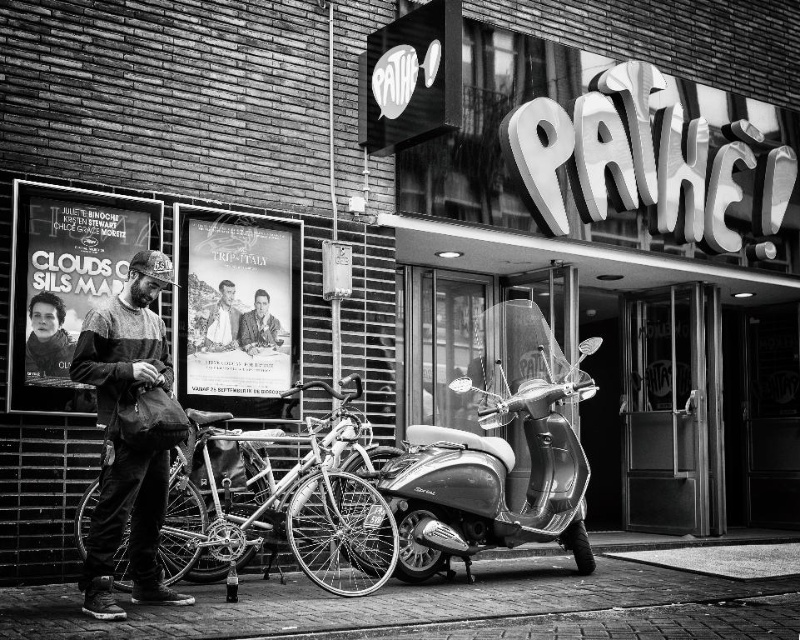
Question: Can you confirm if shiny silver bicycle at center is positioned to the left of matte black jacket at left?

Choices:
 (A) no
 (B) yes

Answer: (A)

Question: Which object appears closest to the camera in this image?

Choices:
 (A) shiny chrome scooter at center
 (B) smooth leather jacket at center
 (C) brick pavement at lower center

Answer: (C)

Question: Which object is closer to the camera taking this photo?

Choices:
 (A) smooth skin face at center
 (B) brick pavement at lower center

Answer: (B)

Question: Is shiny chrome scooter at center below matte black poster at left?

Choices:
 (A) yes
 (B) no

Answer: (A)

Question: Is shiny chrome scooter at center positioned at the back of dark gray sweater at left?

Choices:
 (A) yes
 (B) no

Answer: (A)

Question: Among these points, which one is nearest to the camera?

Choices:
 (A) (110, 532)
 (B) (330, 465)

Answer: (A)